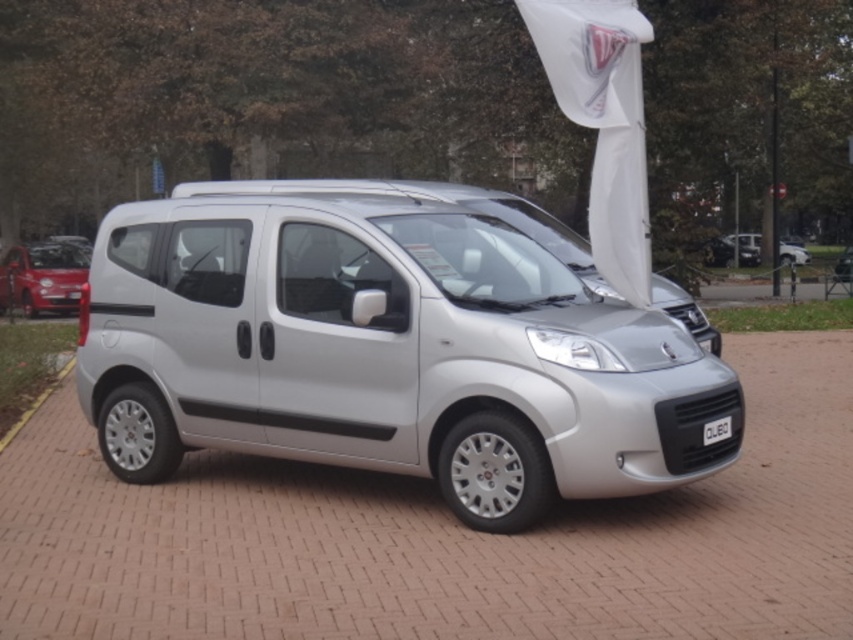
Question: Can you confirm if black plastic license plate at front is positioned to the right of silver metallic van at center?

Choices:
 (A) yes
 (B) no

Answer: (B)

Question: Is matte red car at left to the left of black plastic license plate at front from the viewer's perspective?

Choices:
 (A) no
 (B) yes

Answer: (B)

Question: Based on their relative distances, which object is nearer to the brick pavement at center?

Choices:
 (A) matte red car at left
 (B) silver metallic van at center
 (C) satin silver minivan at center

Answer: (C)

Question: Among these points, which one is nearest to the camera?

Choices:
 (A) (780, 243)
 (B) (61, 248)
 (C) (16, 611)

Answer: (C)

Question: Which object is closer to the camera taking this photo?

Choices:
 (A) satin silver minivan at center
 (B) silver metallic van at center
 (C) satin silver van at right
 (D) matte red car at left

Answer: (A)

Question: Is matte red car at left bigger than black plastic license plate at front?

Choices:
 (A) no
 (B) yes

Answer: (B)